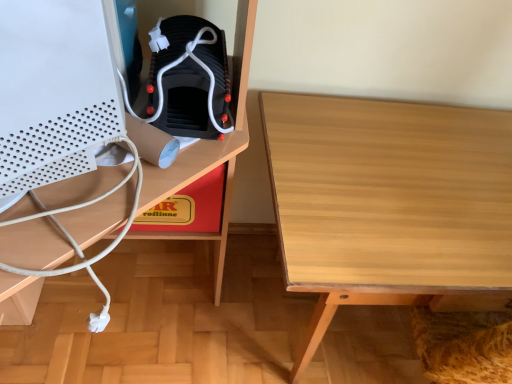
Question: Is light wood table at center wider or thinner than red cardboard box at center?

Choices:
 (A) thin
 (B) wide

Answer: (B)

Question: From the image's perspective, is light wood table at center located above or below red cardboard box at center?

Choices:
 (A) below
 (B) above

Answer: (A)

Question: Which of these objects is positioned closest to the black matte boot at center?

Choices:
 (A) white matte desktop computer at left
 (B) red cardboard box at center
 (C) light wood table at center

Answer: (A)

Question: Which object is positioned farthest from the black matte boot at center?

Choices:
 (A) light wood table at center
 (B) red cardboard box at center
 (C) white matte desktop computer at left

Answer: (A)